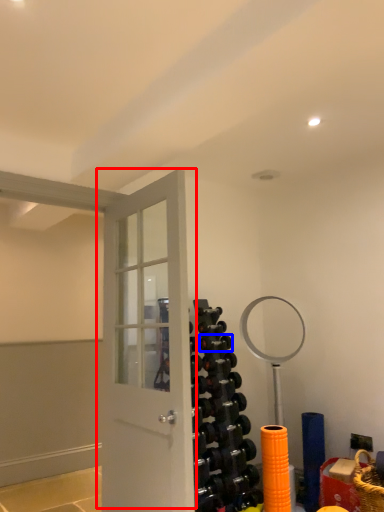
Question: Which object is further to the camera taking this photo, door (highlighted by a red box) or dumbbell (highlighted by a blue box)?

Choices:
 (A) door
 (B) dumbbell

Answer: (B)